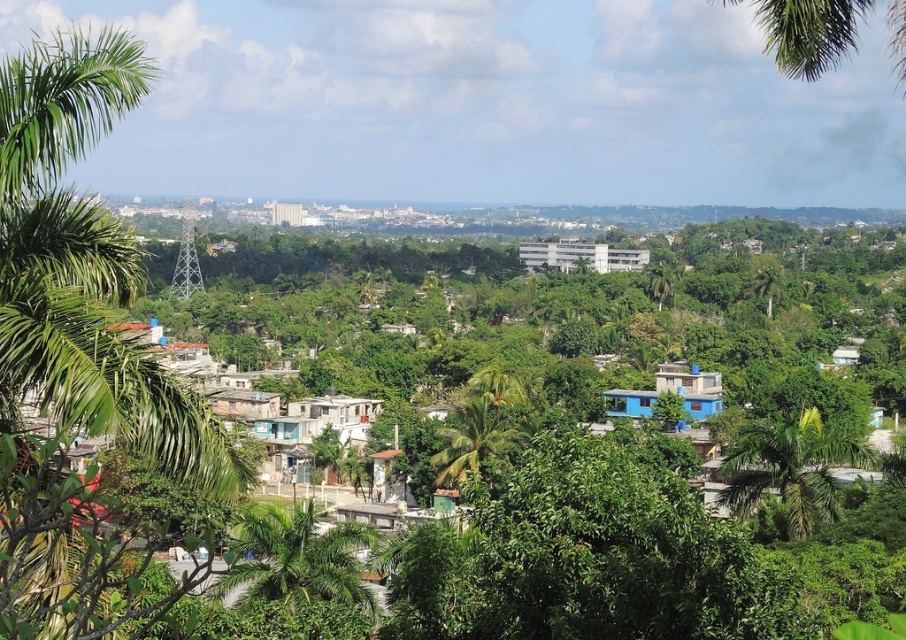
You are standing in the tropical landscape and want to find the tallest palm tree between the green leafy palm tree at left and the green leafy palm tree at center. Which one should you look towards?

The green leafy palm tree at left is much taller than the green leafy palm tree at center, so you should look towards the left.

You are standing in the tropical landscape and want to take a photo of both the green leafy palm tree at lower right and the green leafy palm tree at center. Which palm tree is closer to you?

The green leafy palm tree at lower right is positioned over the green leafy palm tree at center, so it is closer to you.